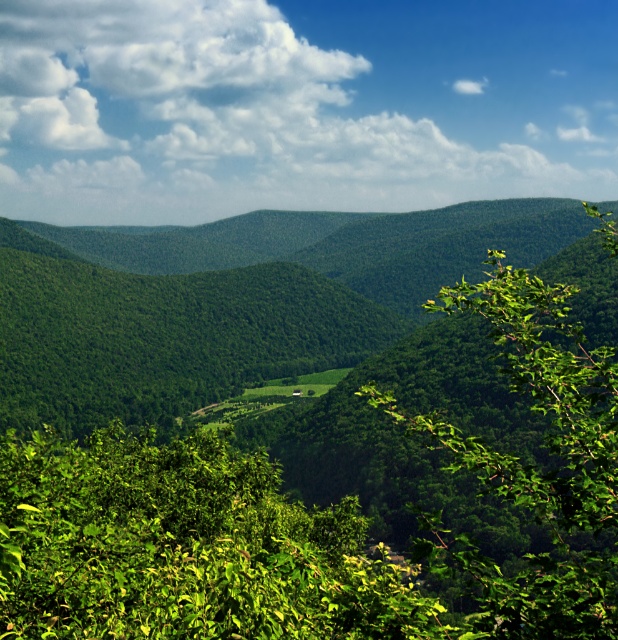
This screenshot has height=640, width=618. What do you see at coordinates (300, 106) in the screenshot? I see `white fluffy cloud at upper center` at bounding box center [300, 106].

Between point (530, 99) and point (243, 605), which one is positioned behind?

Positioned behind is point (530, 99).

Describe the element at coordinates (300, 106) in the screenshot. I see `white fluffy cloud at upper center` at that location.

Locate an element on the screen. This screenshot has height=640, width=618. white fluffy cloud at upper center is located at coordinates (300, 106).